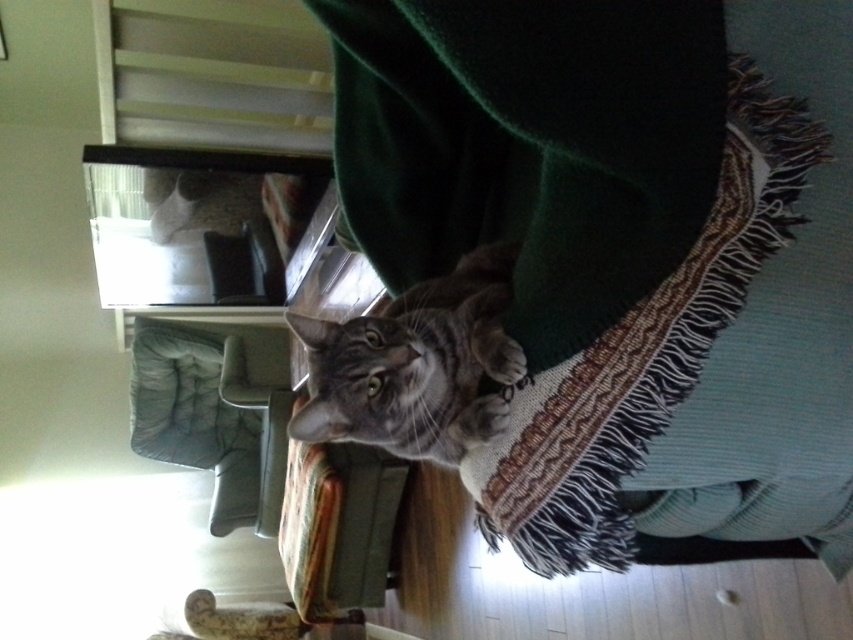
Question: Can you confirm if gray tabby cat at center is positioned above matte gray chair at lower left?

Choices:
 (A) no
 (B) yes

Answer: (B)

Question: Estimate the real-world distances between objects in this image. Which object is farther from the matte gray chair at lower left?

Choices:
 (A) velvet green blanket at center
 (B) gray tabby cat at center

Answer: (A)

Question: In this image, where is velvet green blanket at center located relative to gray tabby cat at center?

Choices:
 (A) right
 (B) left

Answer: (A)

Question: Which object is farther from the camera taking this photo?

Choices:
 (A) matte gray chair at lower left
 (B) velvet green blanket at center

Answer: (A)

Question: Is velvet green blanket at center behind gray tabby cat at center?

Choices:
 (A) no
 (B) yes

Answer: (A)

Question: Which point is farther from the camera taking this photo?

Choices:
 (A) (334, 390)
 (B) (708, 22)
 (C) (206, 451)

Answer: (C)